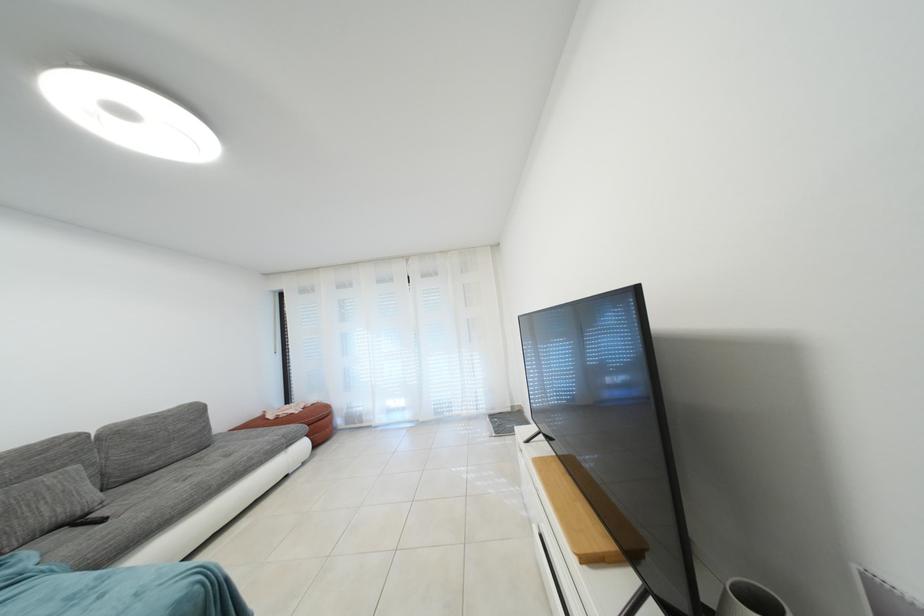
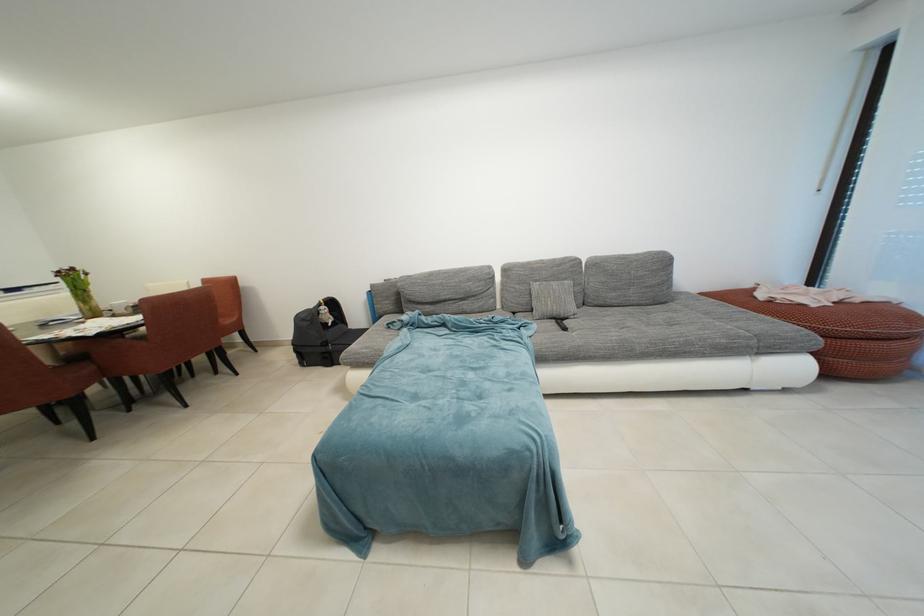
The point at (71, 537) is marked in the first image. Where is the corresponding point in the second image?

(560, 328)